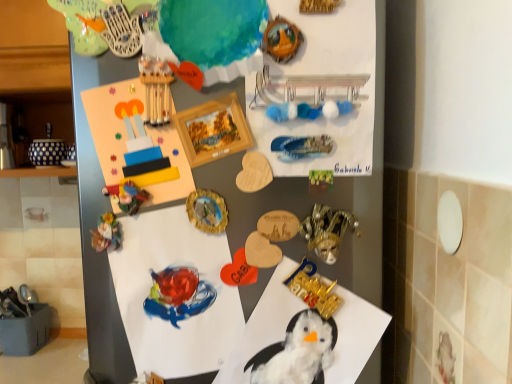
Question: Relative to porcelain figurine at lower left, which is counted as the second art, starting from the top, is gold metallic mask at center-right, the first toy in the top-to-bottom sequence, in front or behind?

Choices:
 (A) behind
 (B) front

Answer: (B)

Question: Considering the relative positions of gold metallic mask at center-right, the first toy in the top-to-bottom sequence, and porcelain figurine at lower left, arranged as the first art when ordered from the bottom, in the image provided, is gold metallic mask at center-right, the first toy in the top-to-bottom sequence, to the left or to the right of porcelain figurine at lower left, arranged as the first art when ordered from the bottom,?

Choices:
 (A) left
 (B) right

Answer: (B)

Question: Based on their relative distances, which object is nearer to the gold metallic mask at center-right, the second toy in the bottom-to-top sequence?

Choices:
 (A) wooden postcard at upper center
 (B) white matte paper at upper center, positioned as the 3th paper in bottom-to-top order
 (C) wooden picture frame at center
 (D) gold metallic mask at center, placed as the 2th toy when sorted from top to bottom
 (E) watercolor paper at center, placed as the second paper when sorted from bottom to top

Answer: (D)

Question: Which object is the farthest from the wooden picture frame at center?

Choices:
 (A) wooden postcard at upper center
 (B) gold metallic mask at center, which ranks as the first toy in bottom-to-top order
 (C) white matte paper at upper center, which is the 1th paper in top-to-bottom order
 (D) white fluffy paper at center, which appears as the first paper when ordered from the bottom
 (E) watercolor paper at center, the 2th paper viewed from the top

Answer: (D)